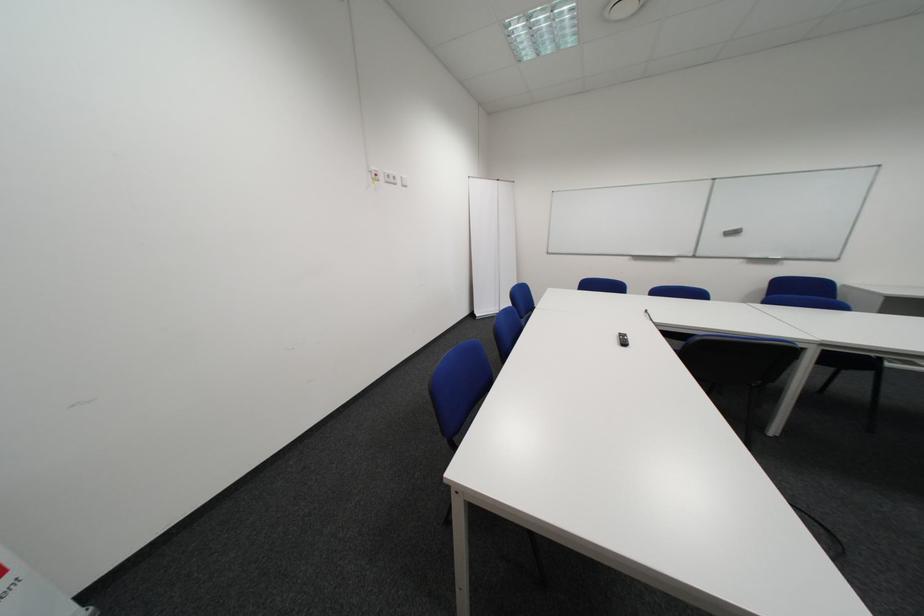
Image resolution: width=924 pixels, height=616 pixels. Identify the location of power outlet socket. (373, 175).